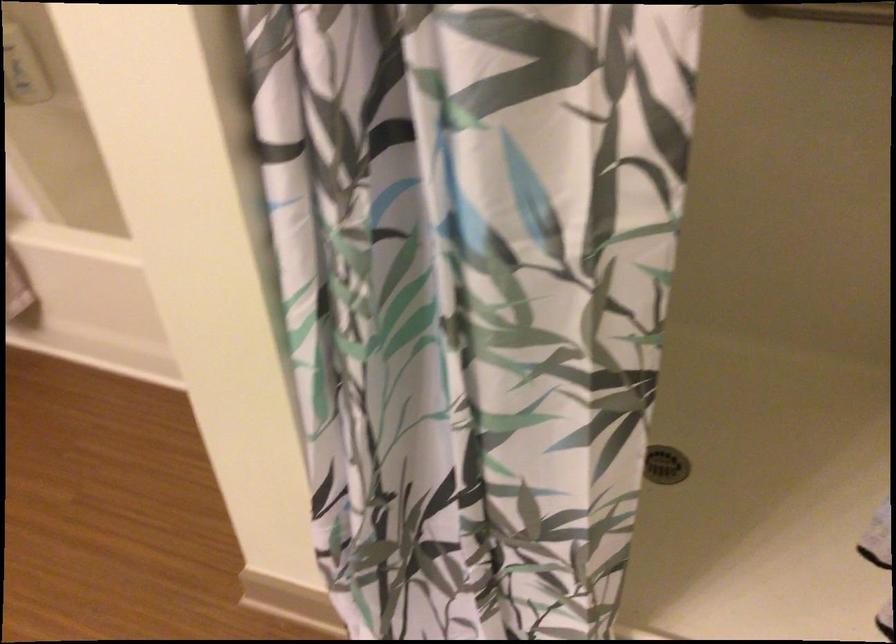
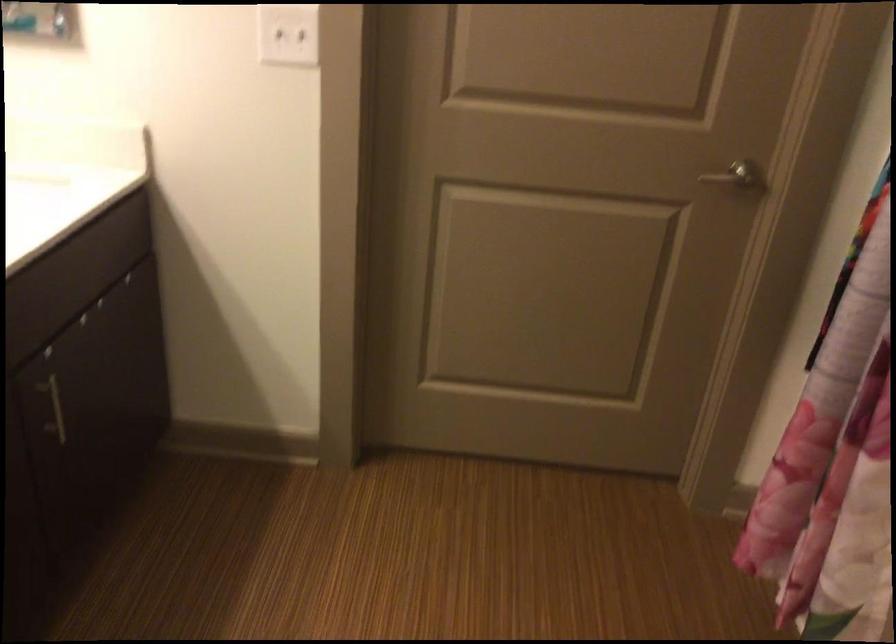
Question: The camera is either moving clockwise (left) or counter-clockwise (right) around the object. The first image is from the beginning of the video and the second image is from the end. Is the camera moving left or right when shooting the video?

Choices:
 (A) Left
 (B) Right

Answer: (B)